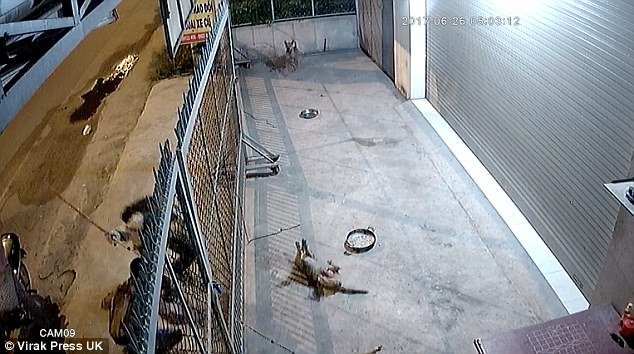
Find the location of a particular element. metal door is located at coordinates (527, 113).